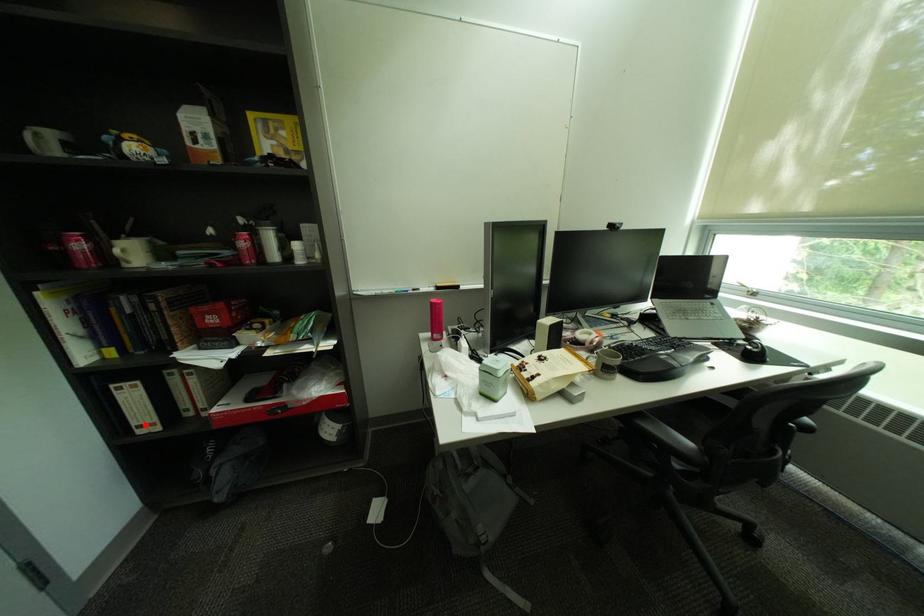
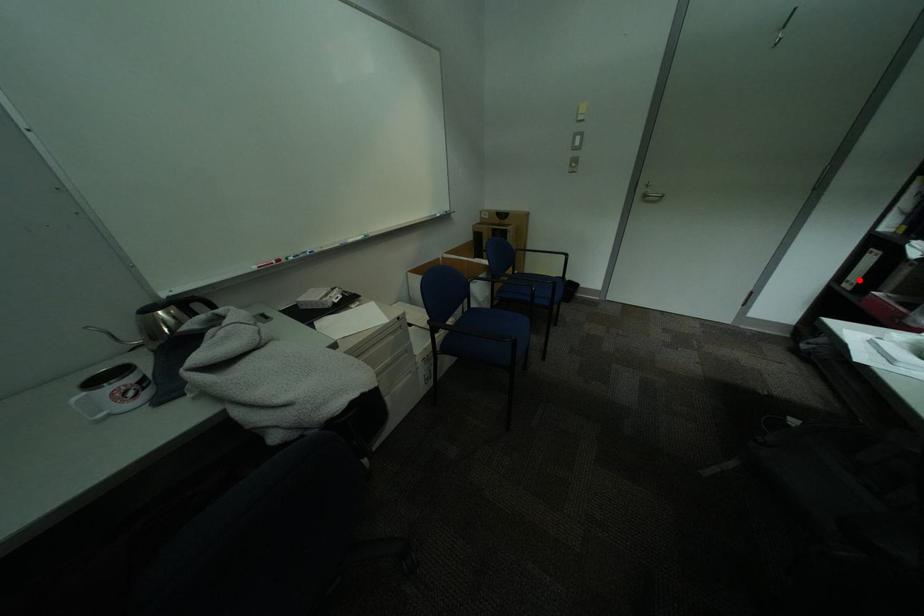
Looking at this image, I am providing you with two images of the same scene from different viewpoints. A red point is marked on the first image and another point is marked on the second image. Is the red point in image1 aligned with the point shown in image2?

Yes